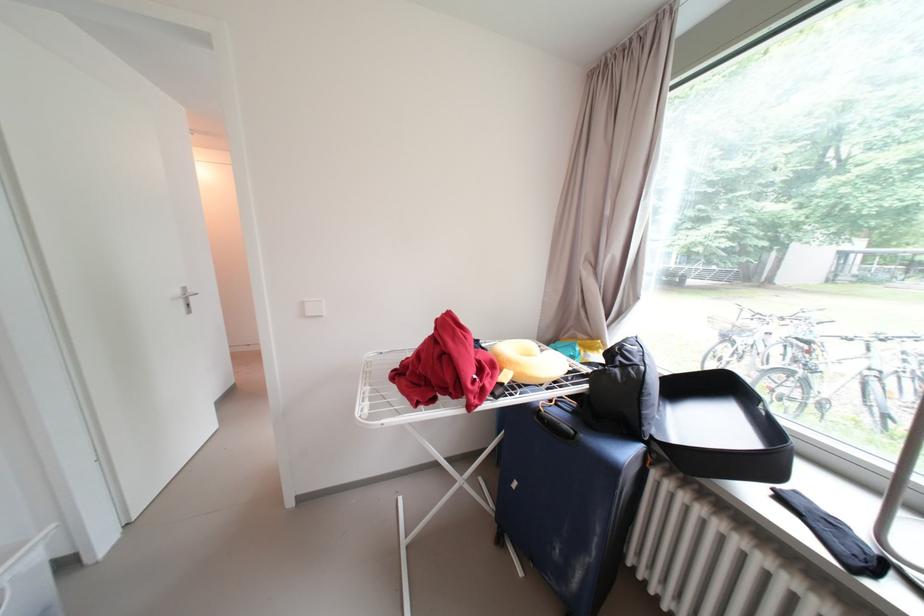
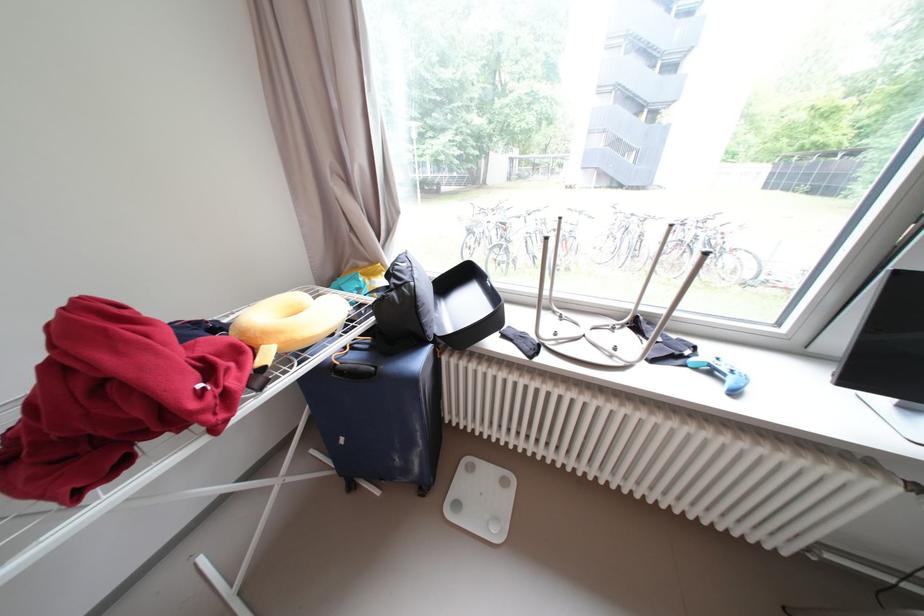
Where in the second image is the point corresponding to [527,371] from the first image?

(290, 339)